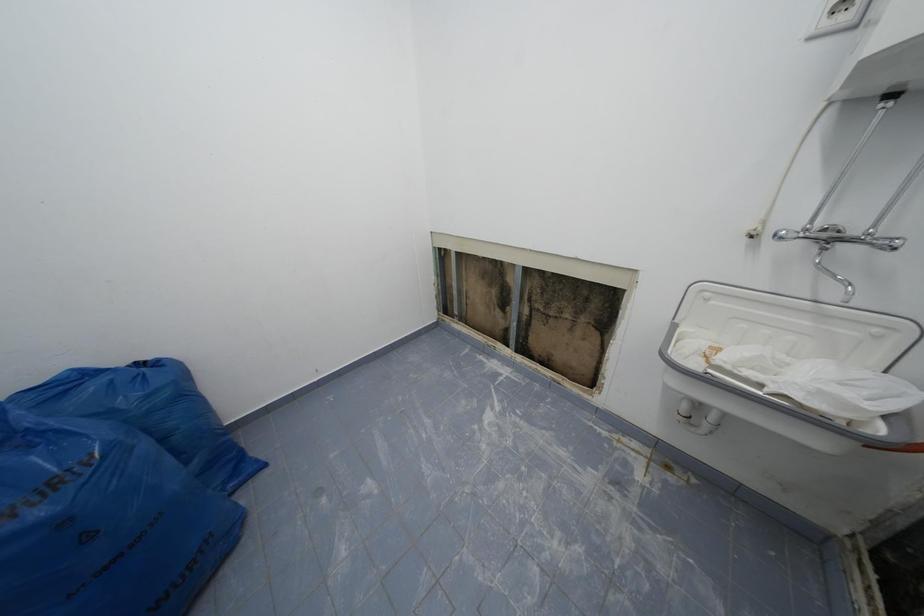
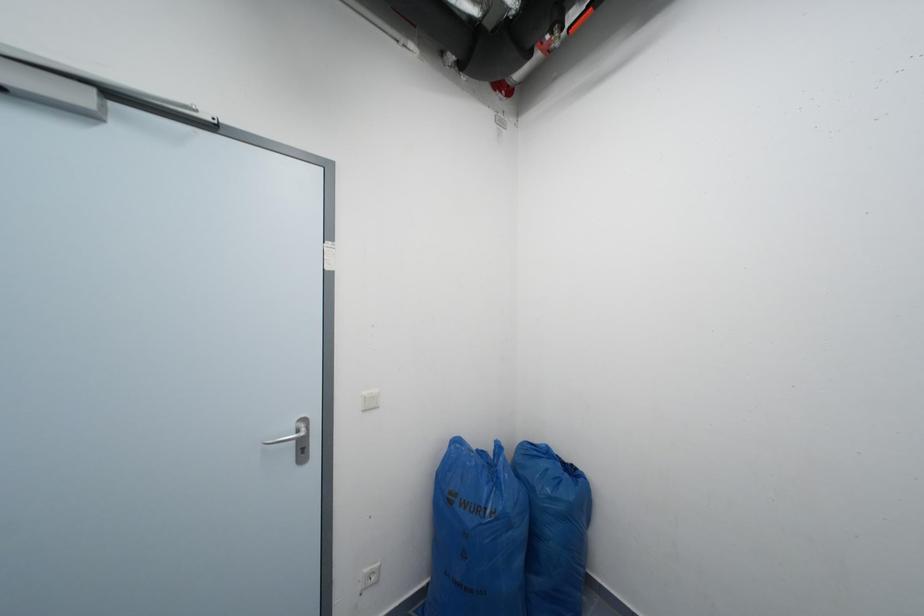
Question: The first image is from the beginning of the video and the second image is from the end. How did the camera likely rotate when shooting the video?

Choices:
 (A) Left
 (B) Right
 (C) Up
 (D) Down

Answer: (A)